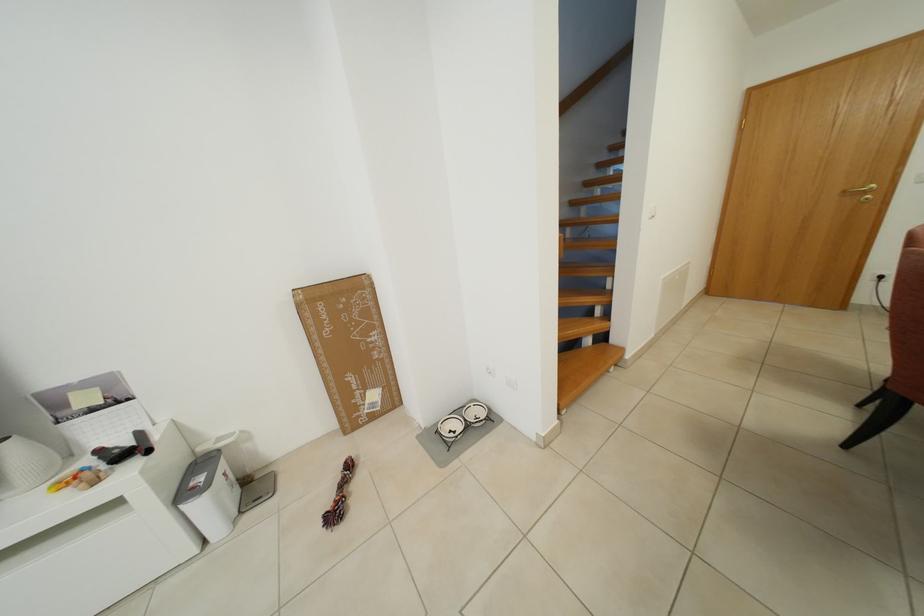
This screenshot has height=616, width=924. In order to click on white drawer handle in this screenshot , I will do `click(54, 508)`.